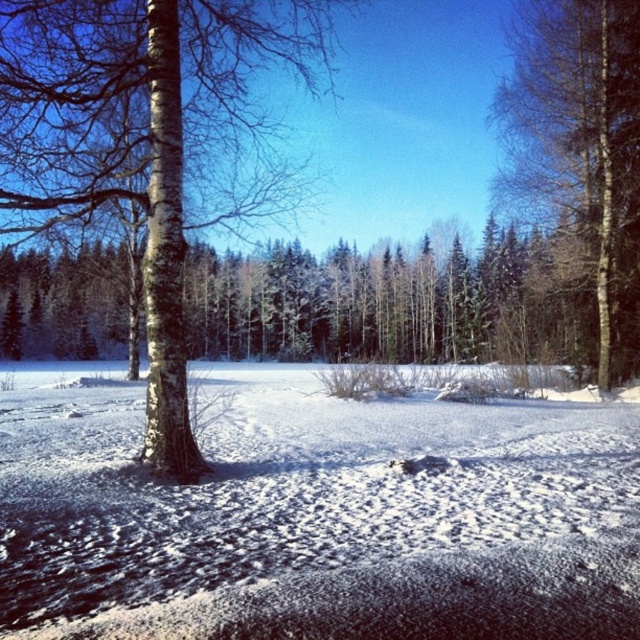
Looking at this image, you are standing in the winter landscape and want to walk from the point closer to you to the point further away. Which path should you take between the two points, point (381, 545) and point (51, 205)?

You should walk from point (381, 545) to point (51, 205) because point (381, 545) is closer to the viewer and point (51, 205) is further away.

You are standing at the center of the image and want to place a small snowman exactly where the white fluffy snow at center is located. According to the coordinates given, can you confirm the exact 2D position where you should place the snowman?

The exact 2D position for placing the snowman is at coordinates point (316, 516).

You are standing at the base of the birch tree in the winter landscape. You see a point marked at coordinates (x=316, y=516). What is located at this point?

The point at coordinates (x=316, y=516) indicates white fluffy snow at center.